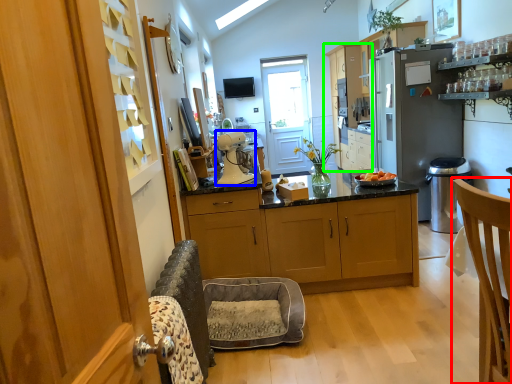
Question: Which object is the farthest from chair (highlighted by a red box)? Choose among these: kitchen appliance (highlighted by a blue box) or cabinetry (highlighted by a green box).

Choices:
 (A) kitchen appliance
 (B) cabinetry

Answer: (B)